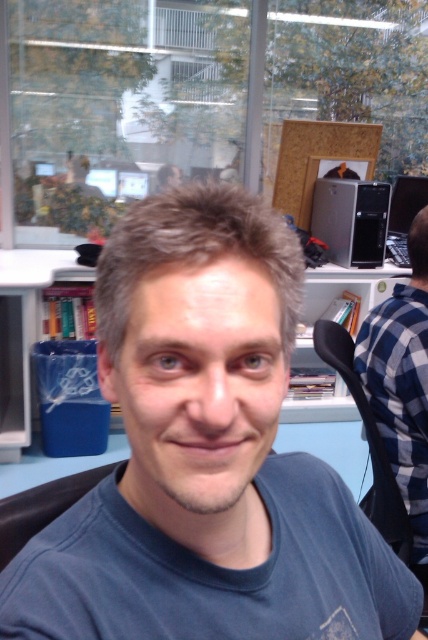
Who is shorter, blue plastic bin at lower left or satin black tower at upper right?

satin black tower at upper right

Is blue plastic bin at lower left closer to the viewer compared to satin black tower at upper right?

Yes, it is.

Is point (297, 348) positioned before point (357, 248)?

No, it is not.

Where is `blue plastic bin at lower left`? This screenshot has width=428, height=640. blue plastic bin at lower left is located at coordinates pos(32,308).

Is point (237, 632) more distant than point (345, 256)?

No.

Does blue cotton shirt at center appear over satin black tower at upper right?

Incorrect, blue cotton shirt at center is not positioned above satin black tower at upper right.

Between point (228, 470) and point (371, 240), which one is positioned behind?

Point (371, 240)

Locate an element on the screen. The image size is (428, 640). blue cotton shirt at center is located at coordinates (x=205, y=456).

Which of these two, blue plaid shirt at right or satin black tower at upper right, stands taller?

Standing taller between the two is blue plaid shirt at right.

Does point (395, 292) lie in front of point (357, 262)?

Yes, it is.

The image size is (428, 640). What do you see at coordinates (401, 381) in the screenshot? I see `blue plaid shirt at right` at bounding box center [401, 381].

At what (x,y) coordinates should I click in order to perform the action: click on blue plaid shirt at right. Please return your answer as a coordinate pair (x, y). Image resolution: width=428 pixels, height=640 pixels. Looking at the image, I should click on (401, 381).